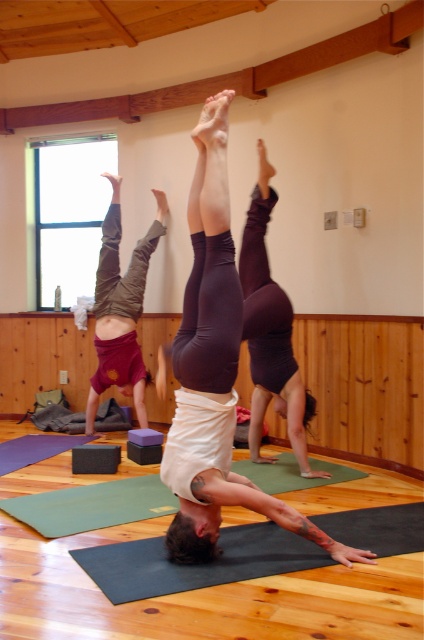
You are a yoga instructor planning to place a new yoga mat on the floor. The new mat is the same size as the wooden beam at upper center. Based on the scene, will the dark gray rubber yoga mat at center fit entirely under the new mat?

The dark gray rubber yoga mat at center has a lesser width compared to the wooden beam at upper center. Therefore, the new mat, which is the same size as the wooden beam at upper center, will be wider than the existing dark gray rubber yoga mat at center. This means the dark gray rubber yoga mat at center can fit entirely under the new mat since it is narrower.

You are a yoga instructor observing the class. You need to place a new yoga block exactly at the center of the dark gray rubber yoga mat at center. According to the coordinates provided, where should you place the block?

The dark gray rubber yoga mat at center is located at point (197, 564), so you should place the yoga block at those coordinates to center it.